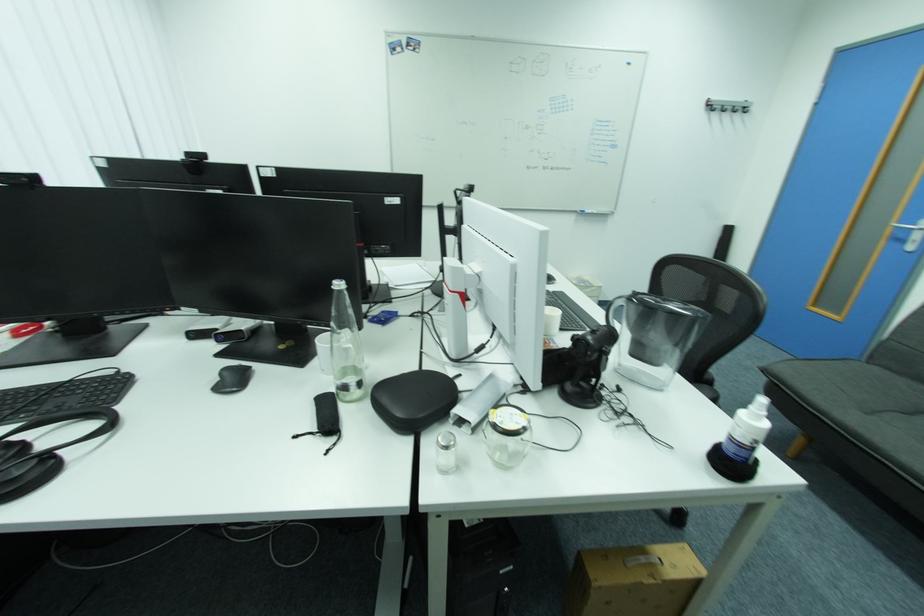
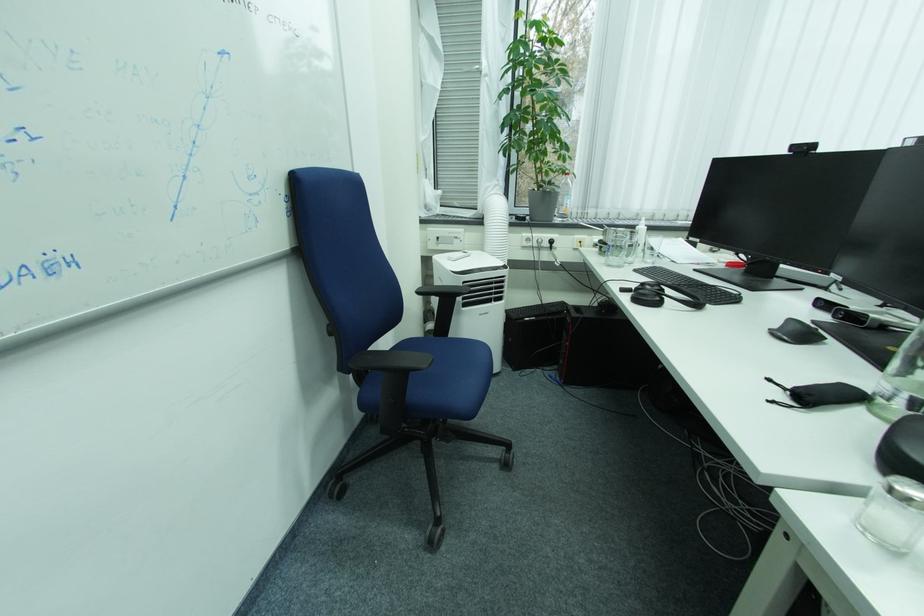
The point at (450, 472) is marked in the first image. Where is the corresponding point in the second image?

(870, 529)